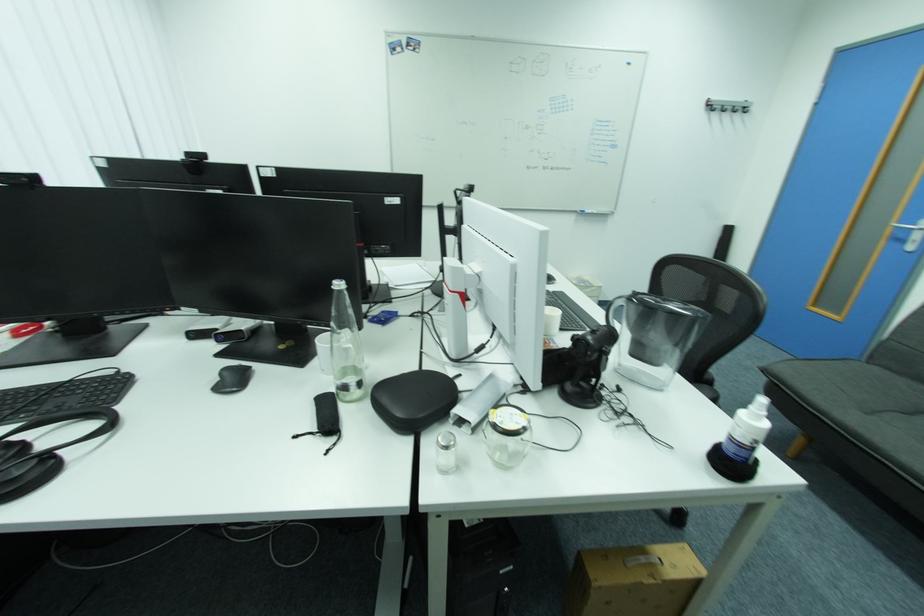
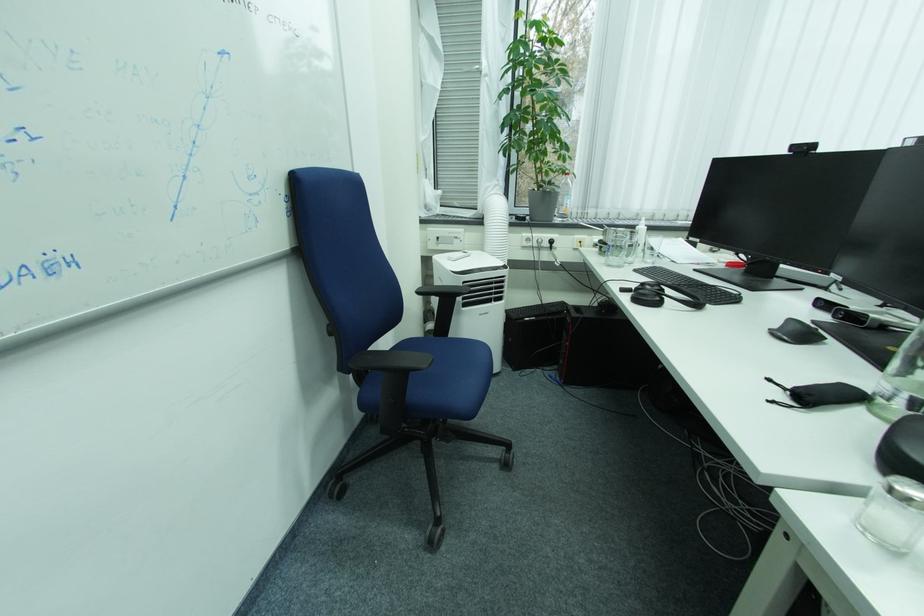
The point at (450, 472) is marked in the first image. Where is the corresponding point in the second image?

(870, 529)